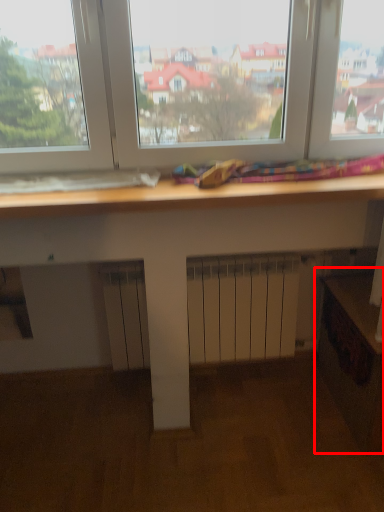
Question: From the image's perspective, what is the correct spatial positioning of workbench (annotated by the red box) in reference to drawer?

Choices:
 (A) above
 (B) below

Answer: (B)